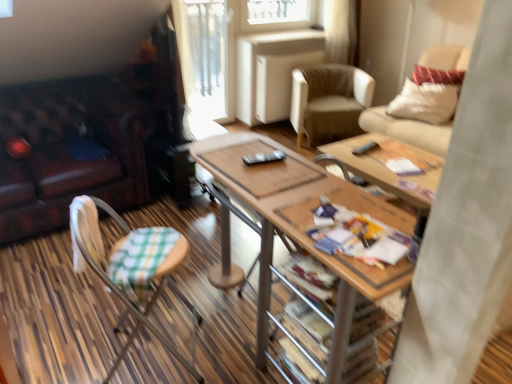
Where is `unoccupied area behind green checkered fabric chair at lower left, which is the 3th chair in right-to-left order`? This screenshot has height=384, width=512. unoccupied area behind green checkered fabric chair at lower left, which is the 3th chair in right-to-left order is located at coordinates (162, 304).